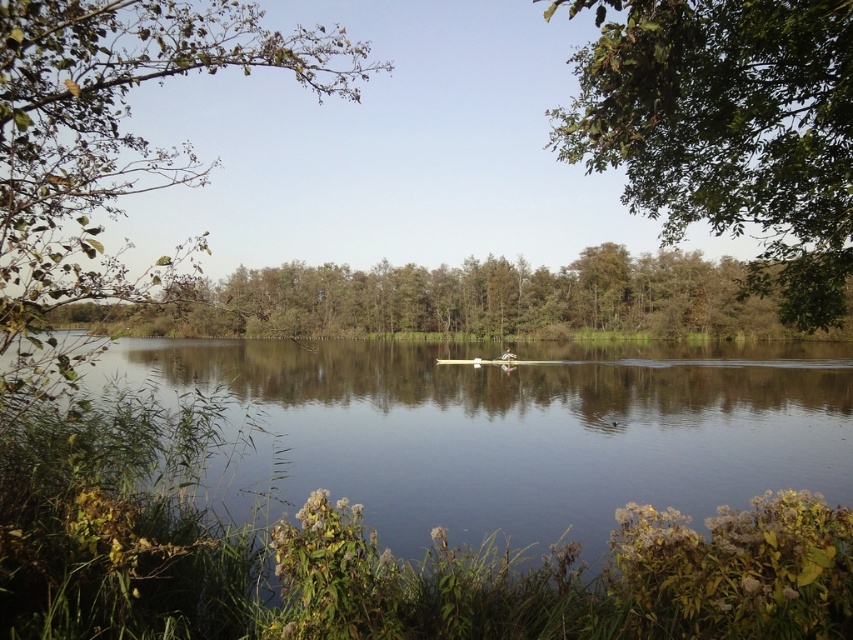
You are a drone operator trying to capture a photo of the clear water at center and the green leafy branch at upper left in the same frame. The drone can only focus on objects within a 20 meter range. Will both objects be in focus?

The distance between the clear water at center and the green leafy branch at upper left is 22.30 meters, which exceeds the drone camera focus range of 20 meters. Therefore, both objects cannot be in focus simultaneously.

Consider the image. You are standing at the lakeside and want to take a photo of the green leafy tree at upper right without the clear water at center in the foreground. Is this possible given their positions?

The green leafy tree at upper right is behind the clear water at center, so you can take a photo of the green leafy tree at upper right without the clear water at center in the foreground by angling the camera to focus on the tree while avoiding the water in the shot.

You are standing at the center of the lakeside and want to take a photo of the green leafy tree at upper right. In which direction should you point your camera to capture it?

The green leafy tree at upper right is located at point coordinates indicating it is positioned towards the upper right direction from your current position at the center. Therefore, you should point your camera towards the upper right to capture it.